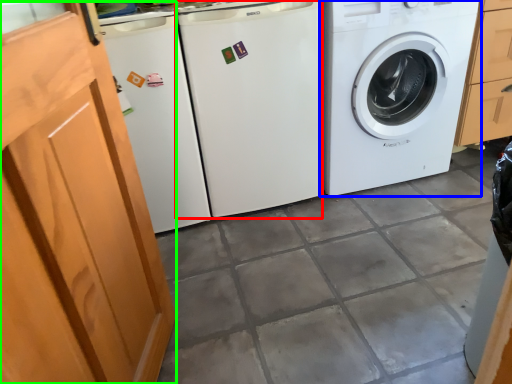
Question: Considering the real-world distances, which object is farthest from washing machine (highlighted by a red box)? washing machine (highlighted by a blue box) or screen door (highlighted by a green box)?

Choices:
 (A) washing machine
 (B) screen door

Answer: (B)